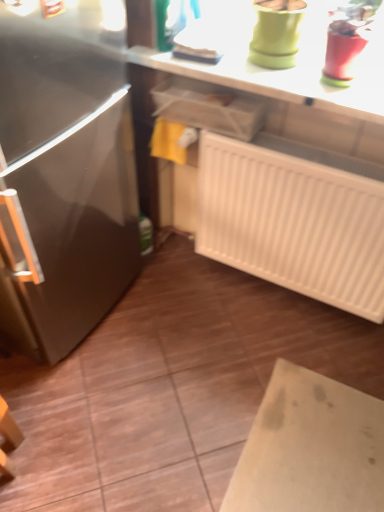
Question: Is white plastic radiator at lower right not within smooth white countertop at upper center?

Choices:
 (A) yes
 (B) no

Answer: (A)

Question: Is white plastic radiator at lower right bigger than smooth white countertop at upper center?

Choices:
 (A) yes
 (B) no

Answer: (A)

Question: From the image's perspective, does white plastic radiator at lower right appear lower than smooth white countertop at upper center?

Choices:
 (A) yes
 (B) no

Answer: (A)

Question: Is white plastic radiator at lower right positioned before smooth white countertop at upper center?

Choices:
 (A) no
 (B) yes

Answer: (A)

Question: Is white plastic radiator at lower right in contact with smooth white countertop at upper center?

Choices:
 (A) no
 (B) yes

Answer: (A)

Question: Does white plastic radiator at lower right have a smaller size compared to smooth white countertop at upper center?

Choices:
 (A) yes
 (B) no

Answer: (B)

Question: Would you say smooth white countertop at upper center is a long distance from white plastic radiator at lower right?

Choices:
 (A) no
 (B) yes

Answer: (A)

Question: Is smooth white countertop at upper center at the right side of white plastic radiator at lower right?

Choices:
 (A) yes
 (B) no

Answer: (B)

Question: Can we say smooth white countertop at upper center lies outside white plastic radiator at lower right?

Choices:
 (A) no
 (B) yes

Answer: (B)

Question: Does smooth white countertop at upper center have a greater width compared to white plastic radiator at lower right?

Choices:
 (A) yes
 (B) no

Answer: (A)

Question: From the image's perspective, is smooth white countertop at upper center beneath white plastic radiator at lower right?

Choices:
 (A) no
 (B) yes

Answer: (A)

Question: Can you confirm if smooth white countertop at upper center is smaller than white plastic radiator at lower right?

Choices:
 (A) yes
 (B) no

Answer: (A)

Question: From a real-world perspective, relative to white plastic radiator at lower right, is smooth white countertop at upper center vertically above or below?

Choices:
 (A) below
 (B) above

Answer: (B)